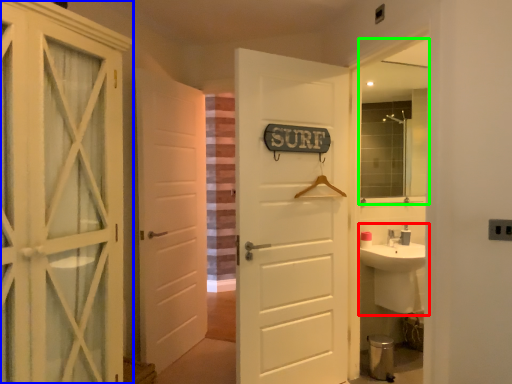
Question: Which object is the farthest from sink (highlighted by a red box)? Choose among these: door (highlighted by a blue box) or mirror (highlighted by a green box).

Choices:
 (A) door
 (B) mirror

Answer: (A)